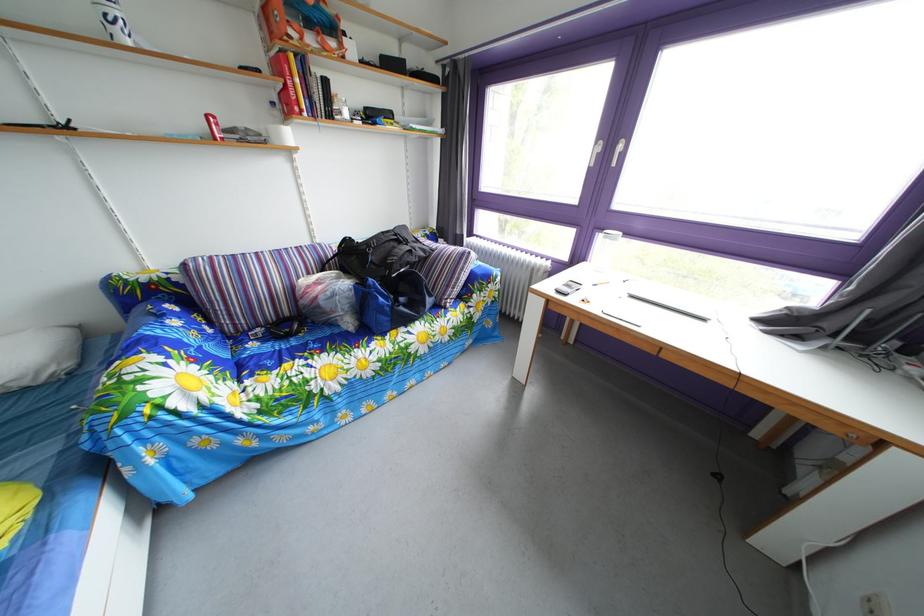
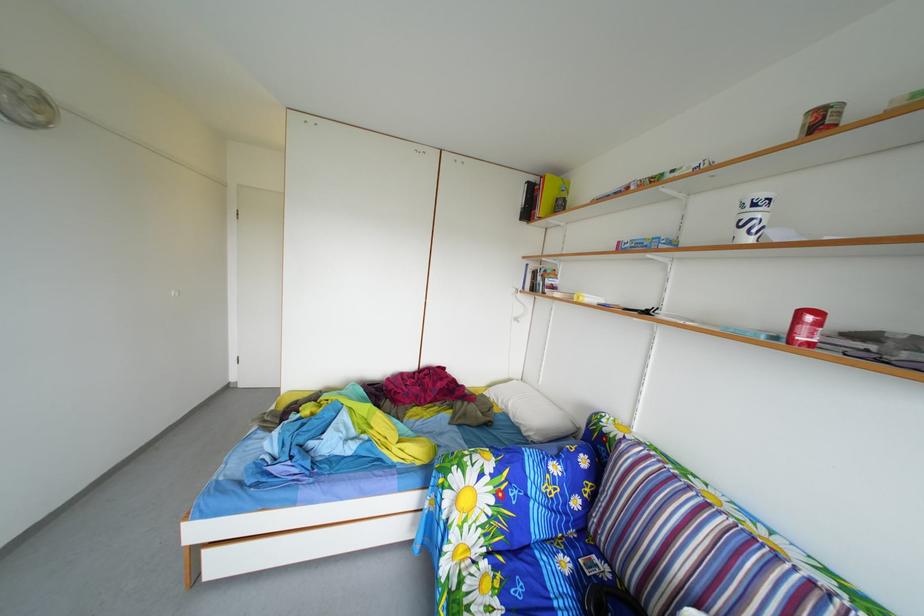
Where in the second image is the point corresponding to [262,353] from the first image?

(576, 570)